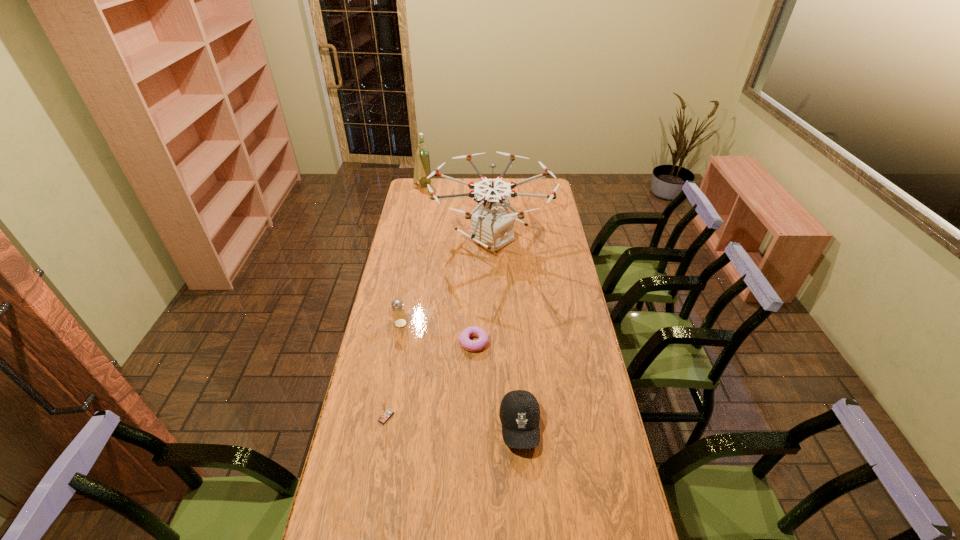
Where is `vacant area that lies between the third nearest object and the matchbox`? vacant area that lies between the third nearest object and the matchbox is located at coordinates (430, 380).

This screenshot has width=960, height=540. Identify the location of vacant area between the fourth nearest object and the matchbox. (394, 370).

The height and width of the screenshot is (540, 960). In order to click on free space between the saltshaker and the matchbox in this screenshot , I will do `click(394, 370)`.

Locate an element on the screen. This screenshot has width=960, height=540. unoccupied position between the matchbox and the second tallest object is located at coordinates (405, 301).

Locate an element on the screen. The image size is (960, 540). empty space between the baseball cap and the matchbox is located at coordinates (453, 422).

Image resolution: width=960 pixels, height=540 pixels. I want to click on the closest object to the drone, so [x=422, y=169].

Image resolution: width=960 pixels, height=540 pixels. I want to click on the second closest object to the doughnut, so click(399, 316).

This screenshot has width=960, height=540. I want to click on vacant space that satisfies the following two spatial constraints: 1. on the front-facing side of the wine bottle; 2. on the left side of the saltshaker, so click(396, 323).

Locate an element on the screen. free region that satisfies the following two spatial constraints: 1. on the front-facing side of the wine bottle; 2. on the left side of the tallest object is located at coordinates (413, 239).

You are a GUI agent. You are given a task and a screenshot of the screen. Output one action in this format:
    pyautogui.click(x=<x>, y=<y>)
    Task: Click on the vacant region that satisfies the following two spatial constraints: 1. on the front-facing side of the wine bottle; 2. on the back side of the fourth nearest object
    
    Given the screenshot: What is the action you would take?
    pyautogui.click(x=396, y=323)